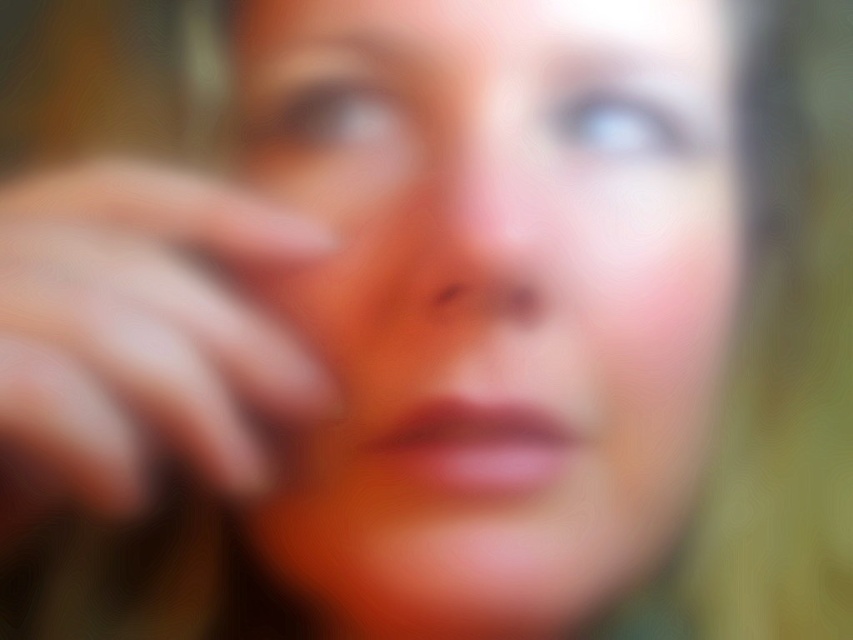
Is smooth skin face at center thinner than pink smooth nose at center?

No.

Between smooth skin face at center and pink smooth nose at center, which one appears on the left side from the viewer's perspective?

Positioned to the left is pink smooth nose at center.

This screenshot has width=853, height=640. What do you see at coordinates (495, 296) in the screenshot?
I see `smooth skin face at center` at bounding box center [495, 296].

The image size is (853, 640). Find the location of `smooth skin face at center`. smooth skin face at center is located at coordinates (495, 296).

Which of these two, smooth skin face at center or smooth skin hand at center, stands taller?

smooth skin face at center is taller.

Between point (489, 224) and point (154, 214), which one is positioned behind?

Point (154, 214)

Where is `smooth skin face at center`? smooth skin face at center is located at coordinates (495, 296).

Between point (170, 328) and point (474, 259), which one is positioned behind?

The point (474, 259) is more distant.

How distant is smooth skin hand at center from pink smooth nose at center?

They are 3.25 inches apart.

The width and height of the screenshot is (853, 640). Describe the element at coordinates (138, 333) in the screenshot. I see `smooth skin hand at center` at that location.

At what (x,y) coordinates should I click in order to perform the action: click on smooth skin hand at center. Please return your answer as a coordinate pair (x, y). The width and height of the screenshot is (853, 640). Looking at the image, I should click on (138, 333).